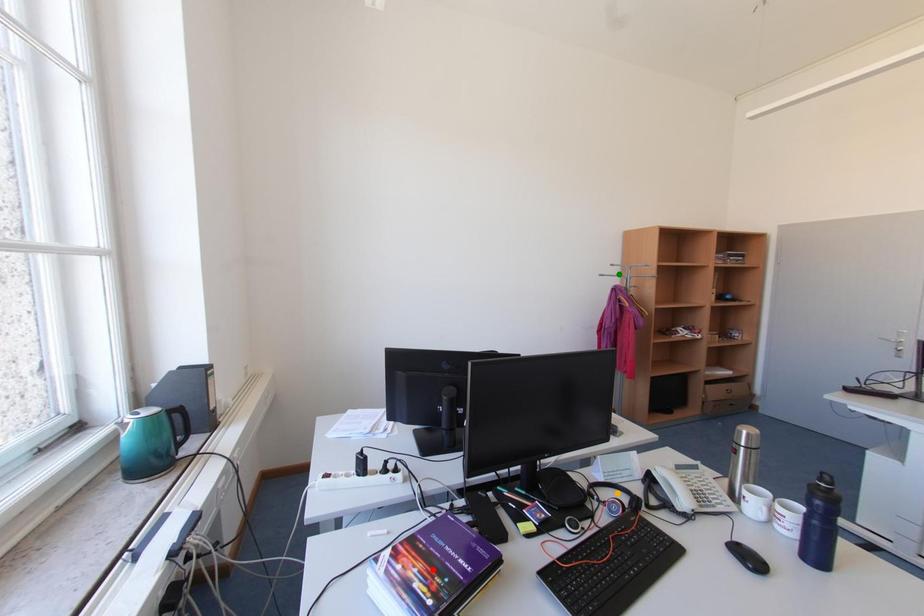
Order these from nearest to farthest:
red point
orange point
green point

red point < orange point < green point